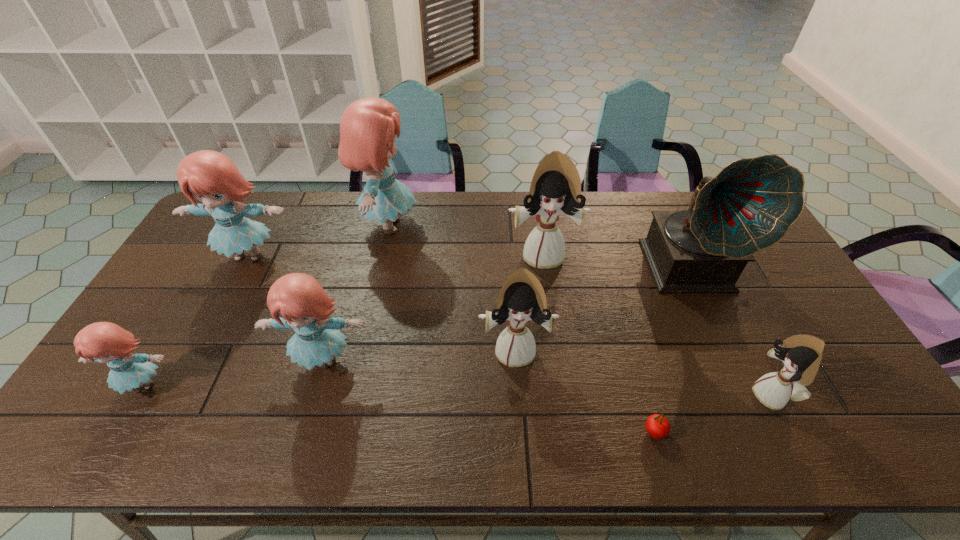
At what (x,y) coordinates should I click in order to perform the action: click on the tallest doll. Please return your answer as a coordinate pair (x, y). The image size is (960, 540). Looking at the image, I should click on (368, 127).

Identify the location of record player. The height and width of the screenshot is (540, 960). (750, 205).

I want to click on the third smallest blue doll, so pyautogui.click(x=210, y=176).

This screenshot has height=540, width=960. What are the coordinates of `the biggest black doll` in the screenshot? It's located at (555, 189).

I want to click on the second smallest blue doll, so click(304, 306).

Find the location of `the second farthest black doll`. the second farthest black doll is located at coordinates (522, 297).

Find the location of `the rightmost doll`. the rightmost doll is located at coordinates [x=801, y=354].

Locate an element on the screen. the nearest black doll is located at coordinates [x=801, y=354].

Find the location of a particular element. Image resolution: width=960 pixels, height=540 pixels. the smallest blue doll is located at coordinates (102, 342).

In order to click on red cherry in this screenshot , I will do pyautogui.click(x=657, y=426).